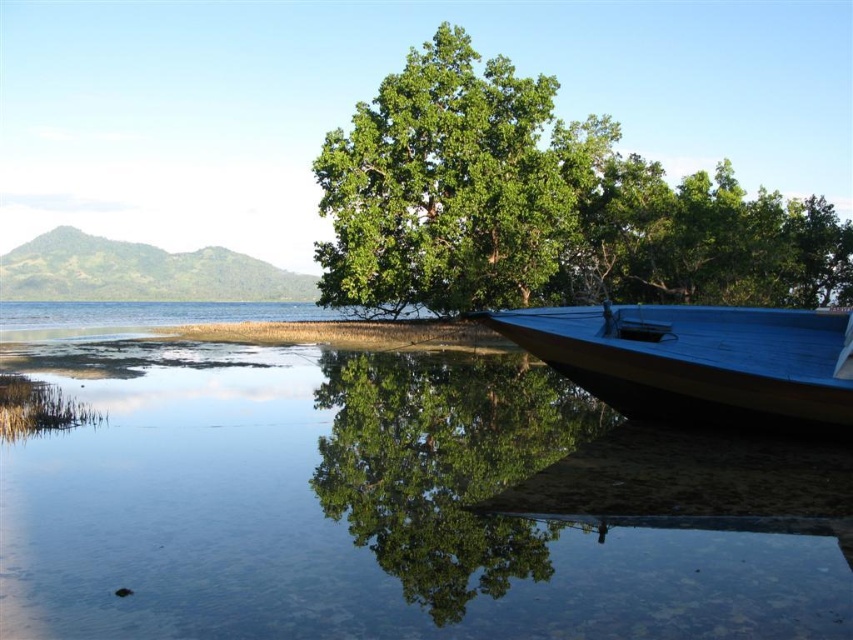
Question: Does clear water at lower left appear over green leafy tree at center?

Choices:
 (A) no
 (B) yes

Answer: (A)

Question: Which point is farther from the camera taking this photo?

Choices:
 (A) (311, 456)
 (B) (451, 308)

Answer: (B)

Question: Is clear water at lower left closer to the viewer compared to green leafy tree at center?

Choices:
 (A) yes
 (B) no

Answer: (A)

Question: Which point appears farthest from the camera in this image?

Choices:
 (A) (703, 333)
 (B) (567, 221)
 (C) (688, 598)

Answer: (B)

Question: Does clear water at lower left appear on the right side of blue polished wood boat at lower right?

Choices:
 (A) no
 (B) yes

Answer: (A)

Question: Which of these objects is positioned closest to the blue polished wood boat at lower right?

Choices:
 (A) green leafy tree at center
 (B) clear water at lower left

Answer: (B)